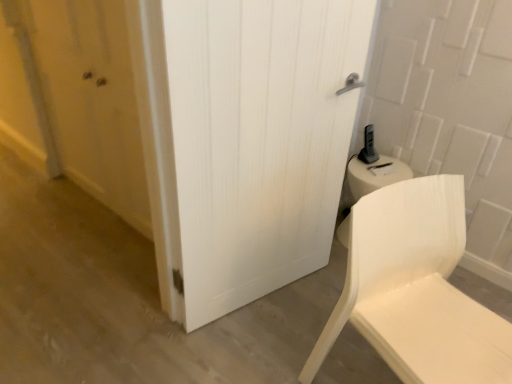
Question: Is white wood door at center in front of white matte chair at lower right?

Choices:
 (A) no
 (B) yes

Answer: (A)

Question: Does white wood door at center have a greater height compared to white matte chair at lower right?

Choices:
 (A) no
 (B) yes

Answer: (B)

Question: Can you confirm if white wood door at center is wider than white matte chair at lower right?

Choices:
 (A) no
 (B) yes

Answer: (A)

Question: Would you say white wood door at center is a long distance from white matte chair at lower right?

Choices:
 (A) no
 (B) yes

Answer: (A)

Question: Considering the relative sizes of white wood door at center and white matte chair at lower right in the image provided, is white wood door at center bigger than white matte chair at lower right?

Choices:
 (A) no
 (B) yes

Answer: (A)

Question: Does point (99, 117) appear closer or farther from the camera than point (350, 321)?

Choices:
 (A) closer
 (B) farther

Answer: (B)

Question: Would you say matte wooden door at left is to the left or to the right of white matte chair at lower right in the picture?

Choices:
 (A) left
 (B) right

Answer: (A)

Question: Considering their positions, is matte wooden door at left located in front of or behind white matte chair at lower right?

Choices:
 (A) behind
 (B) front

Answer: (A)

Question: Is matte wooden door at left inside the boundaries of white matte chair at lower right, or outside?

Choices:
 (A) inside
 (B) outside

Answer: (B)

Question: In the image, is white matte chair at lower right positioned in front of or behind white wood door at center?

Choices:
 (A) behind
 (B) front

Answer: (B)

Question: From a real-world perspective, is white matte chair at lower right physically located above or below white wood door at center?

Choices:
 (A) below
 (B) above

Answer: (A)

Question: Is point click(x=410, y=263) closer or farther from the camera than point click(x=285, y=127)?

Choices:
 (A) farther
 (B) closer

Answer: (B)

Question: From the image's perspective, is white matte chair at lower right located above or below white wood door at center?

Choices:
 (A) below
 (B) above

Answer: (A)

Question: Is white matte chair at lower right bigger or smaller than matte wooden door at left?

Choices:
 (A) small
 (B) big

Answer: (B)

Question: In terms of height, does white matte chair at lower right look taller or shorter compared to matte wooden door at left?

Choices:
 (A) tall
 (B) short

Answer: (B)